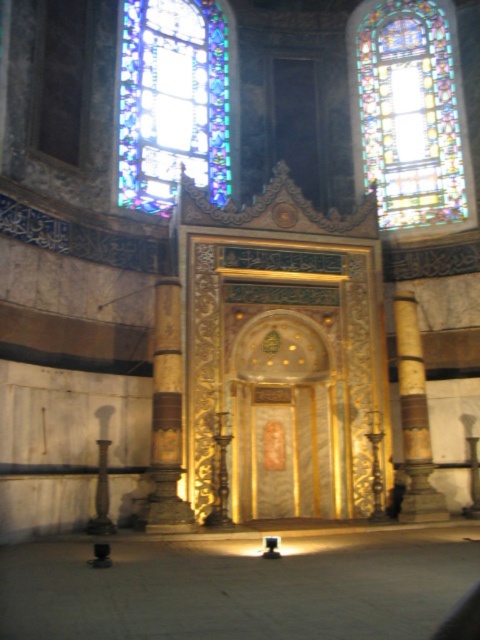
You are an architect examining the interior of a grand building with Islamic architectural elements. You notice two stained glass pieces, the stained glass at upper right and the stained glass window at upper left. Which of these is positioned higher in the space?

The stained glass at upper right is located above the stained glass window at upper left, so it is positioned higher in the space.

You are an architect designing a new building inspired by this historical space. You need to ensure that the stained glass at upper right and the gold polished column at right are proportionally scaled. Which object should be made larger in your design to maintain the original proportions?

The stained glass at upper right should be made larger than the gold polished column at right to maintain the original proportions, as it was originally larger in size.